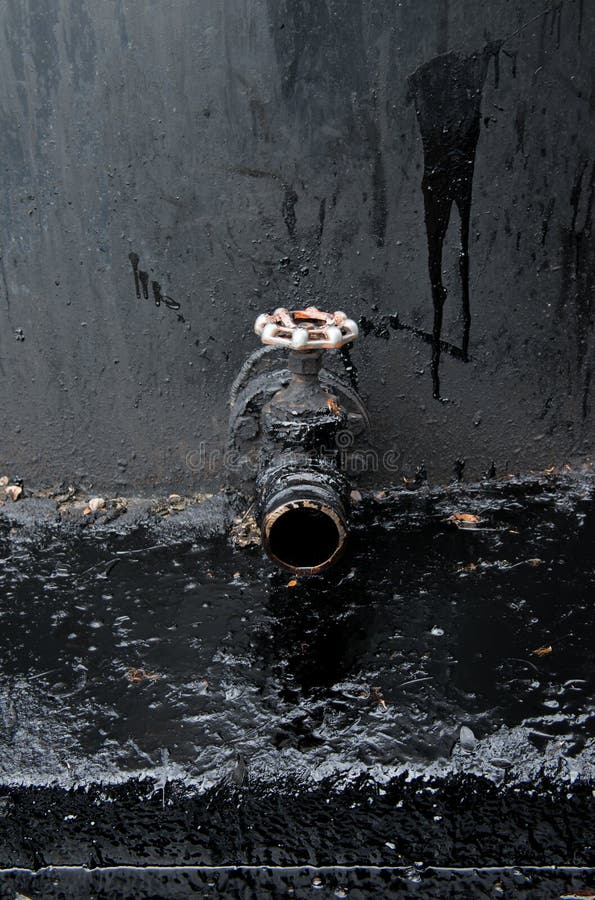
Locate an element on the screen. The image size is (595, 900). black tub is located at coordinates (178, 838).